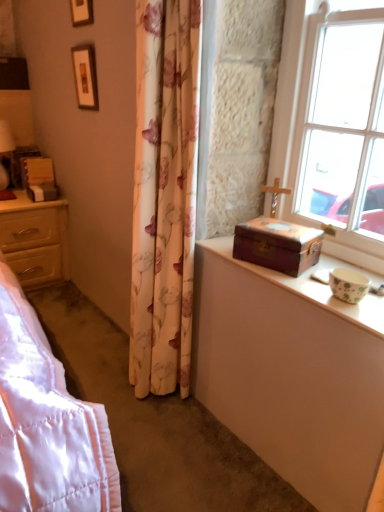
Locate an element on the screen. This screenshot has height=512, width=384. vacant area that is in front of floral fabric curtain at center is located at coordinates (162, 438).